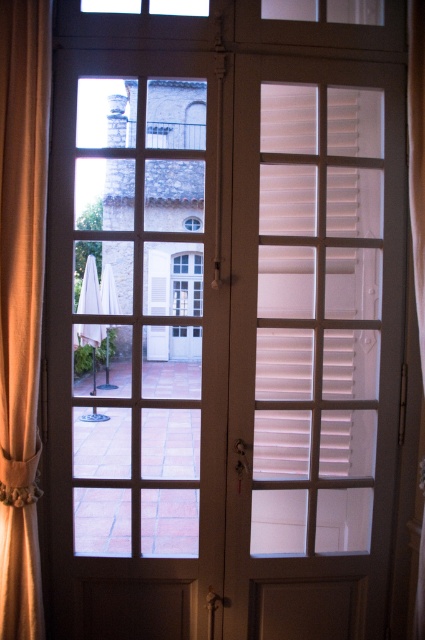
Does beige fabric curtain at left appear on the right side of transparent glass window at upper center?

No, beige fabric curtain at left is not to the right of transparent glass window at upper center.

Image resolution: width=425 pixels, height=640 pixels. Find the location of `beige fabric curtain at left`. beige fabric curtain at left is located at coordinates point(22,301).

Which is above, transparent glass window at upper center or transparent glass window at center?

transparent glass window at upper center is above.

Does transparent glass window at upper center have a greater height compared to transparent glass window at center?

Yes, transparent glass window at upper center is taller than transparent glass window at center.

Locate an element on the screen. This screenshot has height=640, width=425. transparent glass window at upper center is located at coordinates (354, 10).

Which is more to the right, beige fabric curtain at right or transparent glass window at center?

From the viewer's perspective, beige fabric curtain at right appears more on the right side.

Is point (422, 248) closer to viewer compared to point (201, 10)?

Yes.

Image resolution: width=425 pixels, height=640 pixels. What are the coordinates of `beige fabric curtain at right` in the screenshot? It's located at (416, 156).